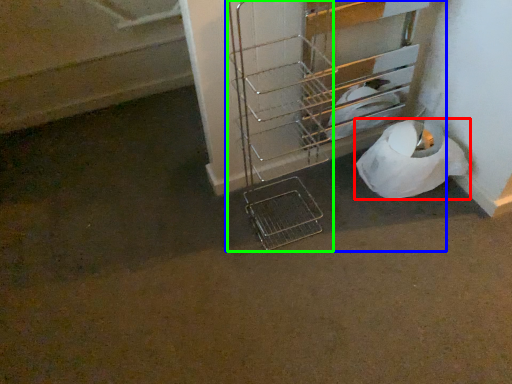
Question: Estimate the real-world distances between objects in this image. Which object is closer to toilet paper (highlighted by a red box), trolley (highlighted by a blue box) or trolley (highlighted by a green box)?

Choices:
 (A) trolley
 (B) trolley

Answer: (A)